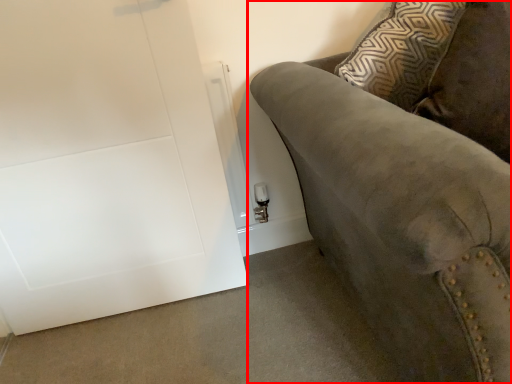
Question: From the image, what is the correct spatial relationship of studio couch (annotated by the red box) in relation to door?

Choices:
 (A) left
 (B) right

Answer: (B)